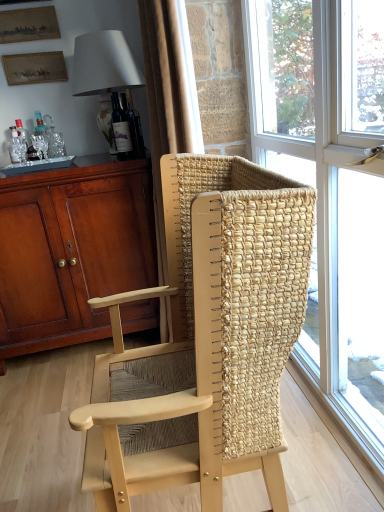
Question: Does wooden picture frame at upper left, placed as the first picture frame when sorted from top to bottom, have a larger size compared to matte gold picture frame at upper left, which appears as the second picture frame when ordered from the bottom?

Choices:
 (A) no
 (B) yes

Answer: (B)

Question: Is wooden picture frame at upper left, placed as the first picture frame when sorted from top to bottom, turned away from matte gold picture frame at upper left, marked as the second picture frame in a top-to-bottom arrangement?

Choices:
 (A) no
 (B) yes

Answer: (A)

Question: Is wooden picture frame at upper left, placed as the first picture frame when sorted from top to bottom, shorter than matte gold picture frame at upper left, marked as the second picture frame in a top-to-bottom arrangement?

Choices:
 (A) no
 (B) yes

Answer: (A)

Question: Does wooden picture frame at upper left, marked as the third picture frame in a bottom-to-top arrangement, turn towards matte gold picture frame at upper left, marked as the second picture frame in a top-to-bottom arrangement?

Choices:
 (A) no
 (B) yes

Answer: (A)

Question: From the image's perspective, is wooden picture frame at upper left, marked as the third picture frame in a bottom-to-top arrangement, on top of matte gold picture frame at upper left, marked as the second picture frame in a top-to-bottom arrangement?

Choices:
 (A) yes
 (B) no

Answer: (A)

Question: In the image, is matte gold picture frame at upper left, which appears as the second picture frame when ordered from the bottom, positioned in front of or behind white fabric lampshade at upper left?

Choices:
 (A) front
 (B) behind

Answer: (B)

Question: Considering the positions of matte gold picture frame at upper left, which appears as the second picture frame when ordered from the bottom, and white fabric lampshade at upper left in the image, is matte gold picture frame at upper left, which appears as the second picture frame when ordered from the bottom, bigger or smaller than white fabric lampshade at upper left?

Choices:
 (A) big
 (B) small

Answer: (B)

Question: Choose the correct answer: Is matte gold picture frame at upper left, which appears as the second picture frame when ordered from the bottom, inside white fabric lampshade at upper left or outside it?

Choices:
 (A) inside
 (B) outside

Answer: (B)

Question: Would you say matte gold picture frame at upper left, which appears as the second picture frame when ordered from the bottom, is to the left or to the right of white fabric lampshade at upper left in the picture?

Choices:
 (A) left
 (B) right

Answer: (A)

Question: Considering the relative positions of translucent glass window at center and matte glass bottle at upper center in the image provided, is translucent glass window at center to the left or to the right of matte glass bottle at upper center?

Choices:
 (A) left
 (B) right

Answer: (B)

Question: Looking at their shapes, would you say translucent glass window at center is wider or thinner than matte glass bottle at upper center?

Choices:
 (A) thin
 (B) wide

Answer: (B)

Question: Does point (284, 145) appear closer or farther from the camera than point (119, 108)?

Choices:
 (A) farther
 (B) closer

Answer: (B)

Question: From the image's perspective, is translucent glass window at center above or below matte glass bottle at upper center?

Choices:
 (A) below
 (B) above

Answer: (A)

Question: Considering their positions, is matte brown cabinet at left located in front of or behind natural wood chair at center?

Choices:
 (A) front
 (B) behind

Answer: (B)

Question: From the image's perspective, is matte brown cabinet at left above or below natural wood chair at center?

Choices:
 (A) above
 (B) below

Answer: (A)